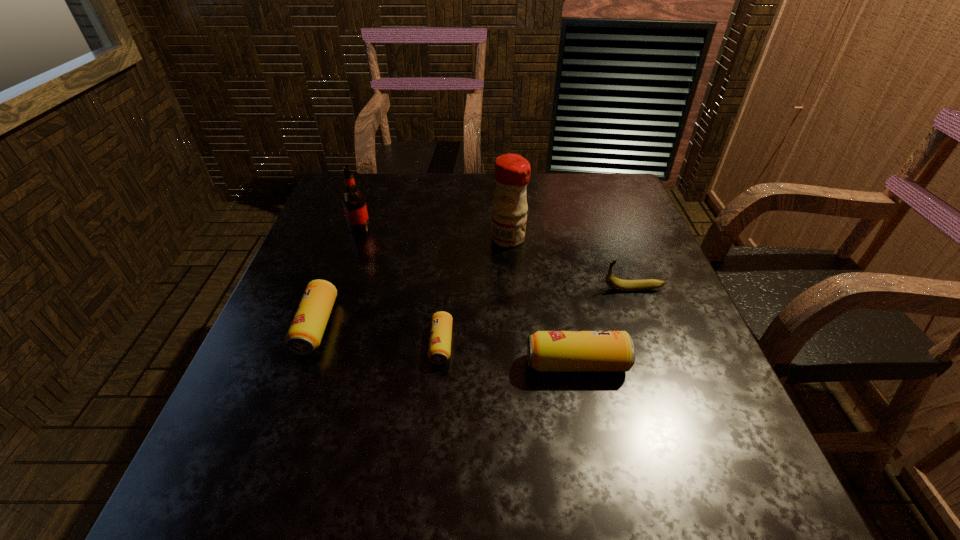
In the image, there is a desktop. What are the coordinates of `vacant area at the near edge` in the screenshot? It's located at (564, 432).

What are the coordinates of `free space at the left edge` in the screenshot? It's located at (348, 242).

The height and width of the screenshot is (540, 960). What are the coordinates of `vacant space at the right edge of the desktop` in the screenshot? It's located at (659, 273).

The height and width of the screenshot is (540, 960). Find the location of `free spot at the far left corner of the desktop`. free spot at the far left corner of the desktop is located at coordinates (338, 195).

Find the location of a particular element. This screenshot has width=960, height=540. vacant region at the far right corner of the desktop is located at coordinates (587, 200).

The width and height of the screenshot is (960, 540). In order to click on vacant region at the near right corner in this screenshot , I will do `click(730, 411)`.

You are a GUI agent. You are given a task and a screenshot of the screen. Output one action in this format:
    pyautogui.click(x=<x>, y=<y>)
    Task: Click on the vacant area that lies between the condiment and the second shortest object
    
    Given the screenshot: What is the action you would take?
    pyautogui.click(x=413, y=282)

Locate an element on the screen. This screenshot has height=540, width=960. vacant area that lies between the third object from left to right and the banana is located at coordinates (538, 316).

You are a GUI agent. You are given a task and a screenshot of the screen. Output one action in this format:
    pyautogui.click(x=<x>, y=<y>)
    Task: Click on the empty space between the second beer can from right to left and the rightmost beer can
    
    Given the screenshot: What is the action you would take?
    pyautogui.click(x=509, y=354)

Locate an element on the screen. The width and height of the screenshot is (960, 540). free space between the third object from left to right and the second tallest beer can is located at coordinates (379, 335).